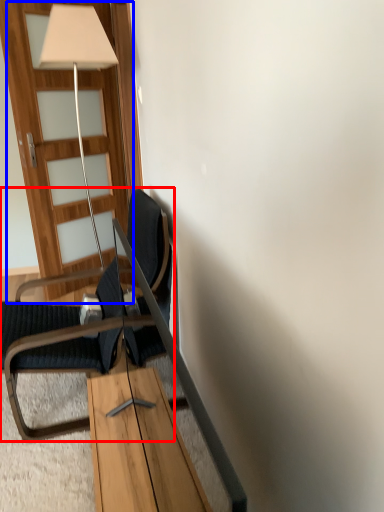
Question: Which object is further to the camera taking this photo, chair (highlighted by a red box) or door (highlighted by a blue box)?

Choices:
 (A) chair
 (B) door

Answer: (B)